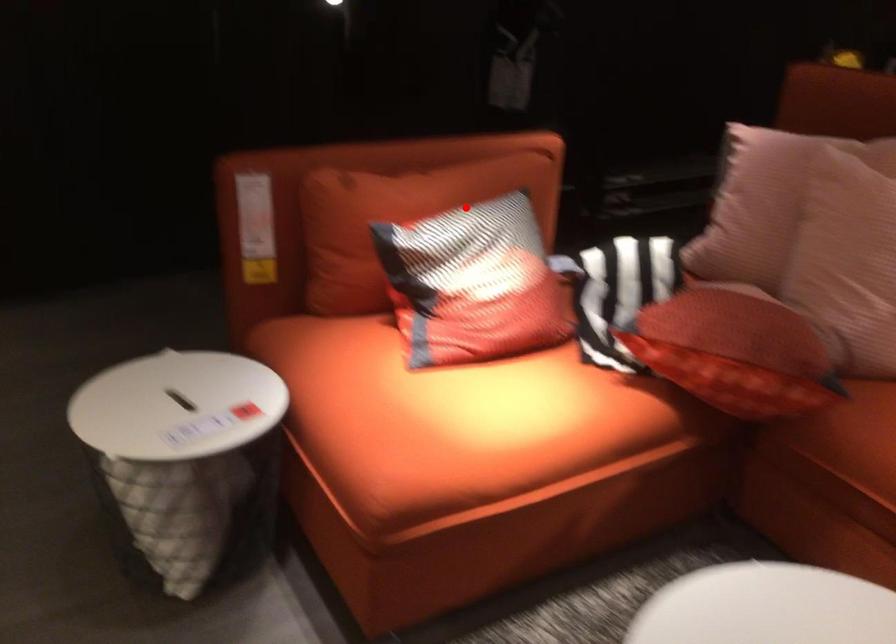
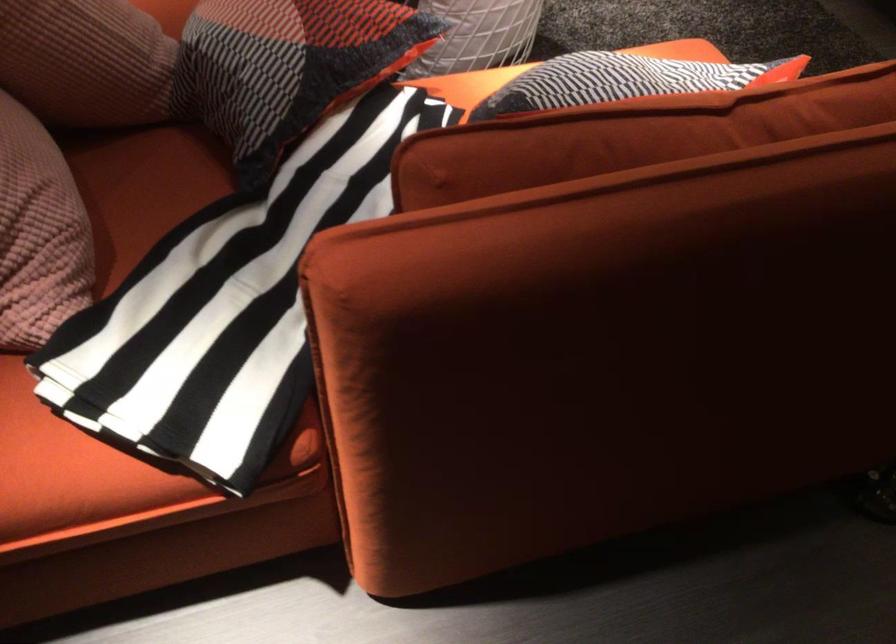
In the second image, find the point that corresponds to the highlighted location in the first image.

(623, 80)